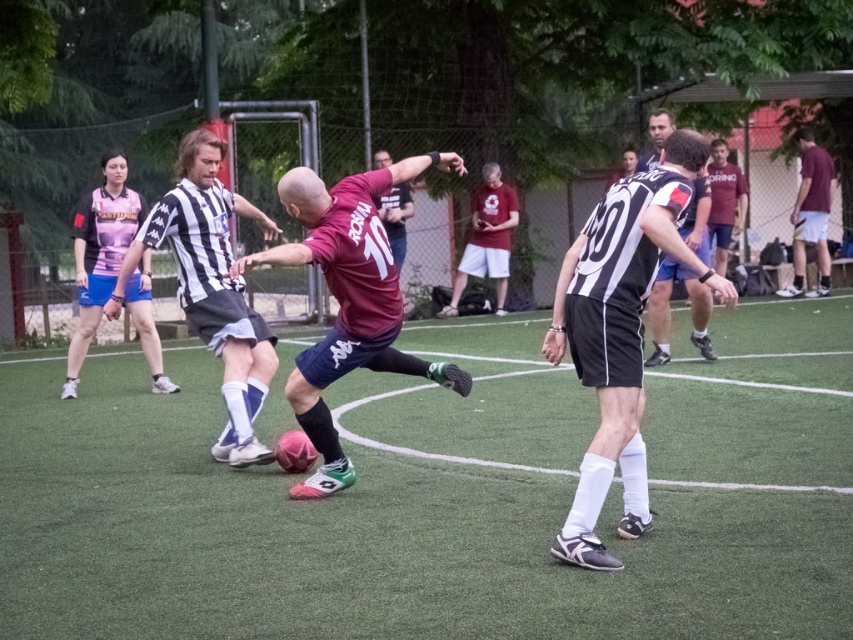
Question: Estimate the real-world distances between objects in this image. Which object is closer to the black and white striped jersey at center?

Choices:
 (A) black and white striped jersey at right
 (B) maroon jersey at center
 (C) black and white striped jersey at left
 (D) green artificial turf at center

Answer: (B)

Question: Based on their relative distances, which object is farther from the green artificial turf at center?

Choices:
 (A) black and white striped jersey at right
 (B) black and white striped jersey at center

Answer: (A)

Question: Is green artificial turf at center smaller than black and white striped jersey at center?

Choices:
 (A) yes
 (B) no

Answer: (B)

Question: Is black and white striped jersey at center above maroon jersey at center?

Choices:
 (A) no
 (B) yes

Answer: (A)

Question: Is maroon jersey at center bigger than black and white striped jersey at left?

Choices:
 (A) yes
 (B) no

Answer: (A)

Question: Which point is closer to the camera?

Choices:
 (A) black and white striped jersey at right
 (B) black and white striped jersey at center
 (C) black and white striped jersey at left
 (D) maroon jersey at center

Answer: (B)